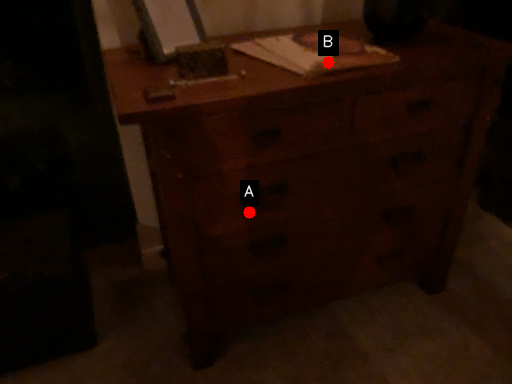
Question: Two points are circled on the image, labeled by A and B beside each circle. Which point is closer to the camera?

Choices:
 (A) A is closer
 (B) B is closer

Answer: (B)